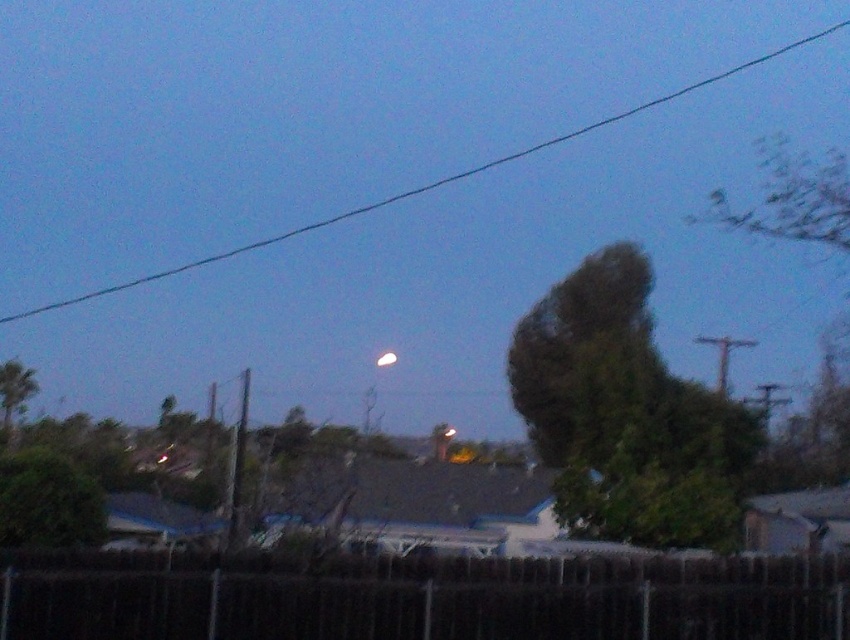
You are standing in the suburban scene and want to take a photo. There are two points marked in the image. The first point is at coordinate point (10, 387) and the second is at point (383, 365). Which point is closer to your camera when taking the photo?

Point (10, 387) is closer to the camera than point (383, 365).